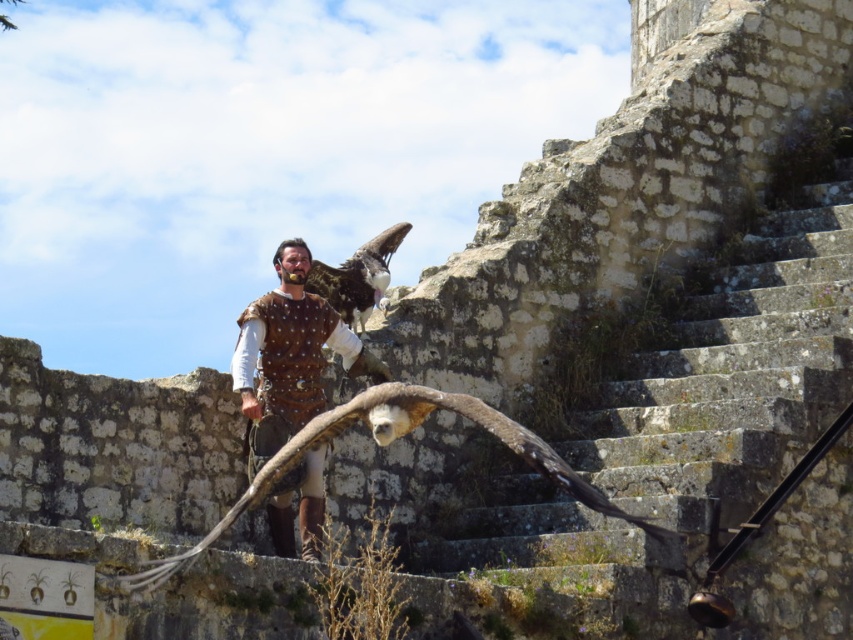
Question: Which point is farther to the camera?

Choices:
 (A) brown feathered eagle at center
 (B) brown leather vest at center
 (C) brown feathered falcon at center

Answer: (A)

Question: Does brown leather vest at center have a lesser width compared to brown feathered falcon at center?

Choices:
 (A) no
 (B) yes

Answer: (B)

Question: Considering the real-world distances, which object is closest to the brown leather vest at center?

Choices:
 (A) brown feathered eagle at center
 (B) brown feathered falcon at center

Answer: (B)

Question: Which of the following is the farthest from the observer?

Choices:
 (A) brown feathered eagle at center
 (B) brown leather vest at center
 (C) brown feathered falcon at center

Answer: (A)

Question: Is brown feathered falcon at center above brown feathered eagle at center?

Choices:
 (A) yes
 (B) no

Answer: (B)

Question: Is brown leather vest at center smaller than brown feathered falcon at center?

Choices:
 (A) no
 (B) yes

Answer: (B)